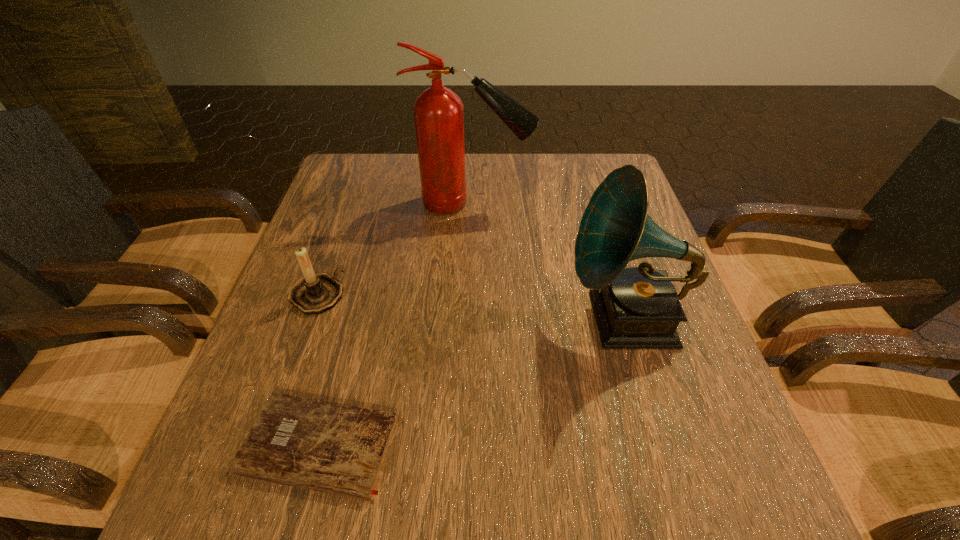
The width and height of the screenshot is (960, 540). Find the location of `vacant region located 0.190m from the horn of the rightmost object`. vacant region located 0.190m from the horn of the rightmost object is located at coordinates (474, 319).

Where is `vacant position located 0.300m on the back of the third tallest object`? vacant position located 0.300m on the back of the third tallest object is located at coordinates (351, 199).

Find the location of a particular element. The height and width of the screenshot is (540, 960). vacant space located on the back of the shortest object is located at coordinates point(371,249).

Find the location of `object positioned at the far edge`. object positioned at the far edge is located at coordinates (438, 112).

Locate an element on the screen. This screenshot has width=960, height=540. object located at the near edge is located at coordinates (339, 449).

The height and width of the screenshot is (540, 960). I want to click on candle holder that is at the left edge, so click(x=315, y=293).

At what (x,y) coordinates should I click in order to perform the action: click on Bible located at the left edge. Please return your answer as a coordinate pair (x, y). This screenshot has width=960, height=540. Looking at the image, I should click on (339, 449).

The width and height of the screenshot is (960, 540). Find the location of `object that is at the right edge`. object that is at the right edge is located at coordinates (638, 307).

Image resolution: width=960 pixels, height=540 pixels. I want to click on object at the near left corner, so click(339, 449).

The width and height of the screenshot is (960, 540). Find the location of `vacant space at the far edge of the desktop`. vacant space at the far edge of the desktop is located at coordinates (419, 173).